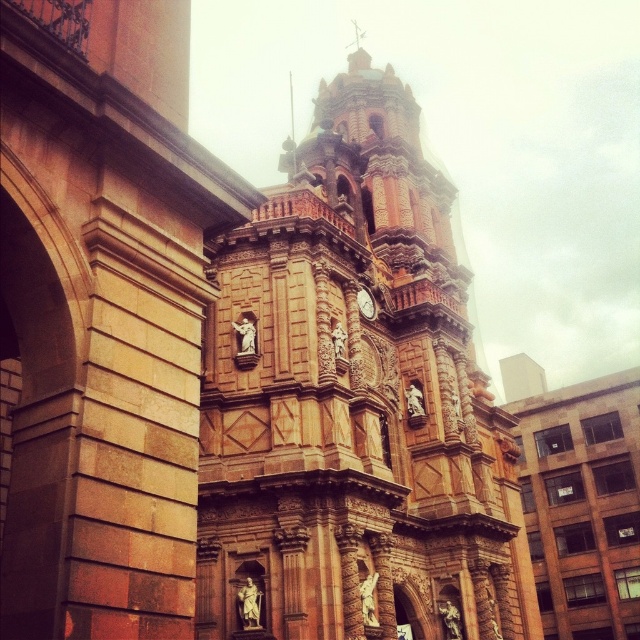
Does brown stone tower at center have a greater width compared to gold metallic clock at center?

Yes, brown stone tower at center is wider than gold metallic clock at center.

Is point (317, 518) behind point (358, 289)?

No, (317, 518) is in front of (358, 289).

Locate an element on the screen. brown stone tower at center is located at coordinates (353, 403).